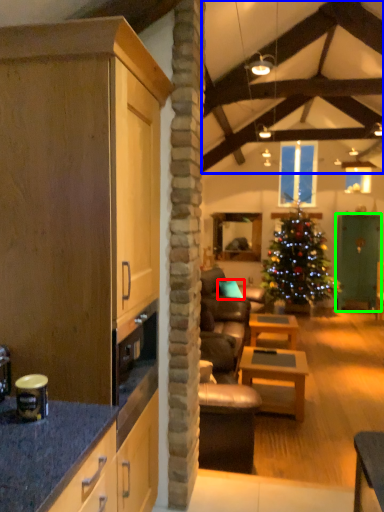
Question: Which is nearer to the pillow (highlighted by a red box)? exhaust hood (highlighted by a blue box) or glass door (highlighted by a green box).

Choices:
 (A) exhaust hood
 (B) glass door

Answer: (B)